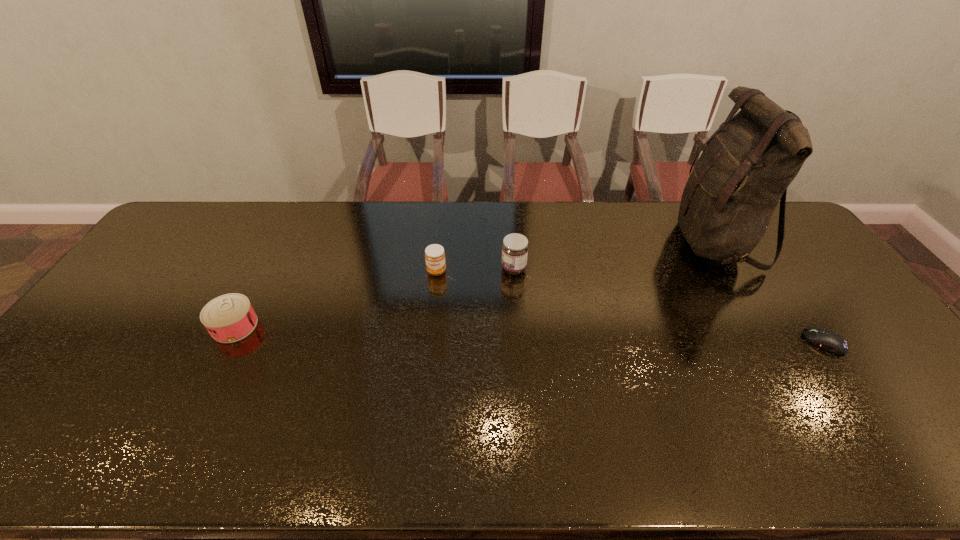
Identify the location of free spot that satisfies the following two spatial constraints: 1. on the back side of the computer equipment; 2. on the front label of the right jam. This screenshot has height=540, width=960. (773, 268).

I want to click on vacant region that satisfies the following two spatial constraints: 1. on the open flap of the backpack; 2. on the front label of the third tallest object, so click(x=732, y=271).

Where is `free point that satisfies the following two spatial constraints: 1. on the front label of the taller jam; 2. on the front side of the second shortest object`? The height and width of the screenshot is (540, 960). free point that satisfies the following two spatial constraints: 1. on the front label of the taller jam; 2. on the front side of the second shortest object is located at coordinates (518, 326).

Locate an element on the screen. Image resolution: width=960 pixels, height=540 pixels. vacant space that satisfies the following two spatial constraints: 1. on the open flap of the shortest object; 2. on the left side of the backpack is located at coordinates (775, 342).